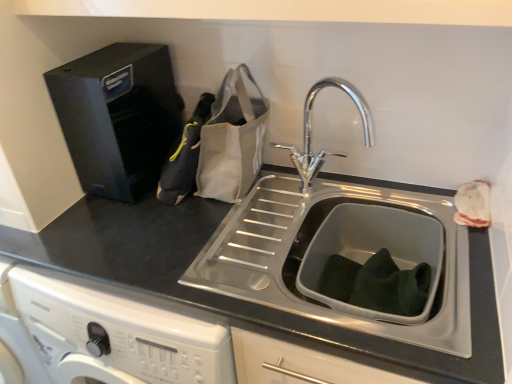
Question: In the image, is black matte countertop at center positioned in front of or behind chrome metallic faucet at center?

Choices:
 (A) front
 (B) behind

Answer: (A)

Question: Would you say black matte countertop at center is inside or outside chrome metallic faucet at center?

Choices:
 (A) inside
 (B) outside

Answer: (B)

Question: Which object is the farthest from the chrome metallic faucet at center?

Choices:
 (A) canvas tote bag at center
 (B) black fabric bag at left
 (C) black plastic water dispenser at upper left
 (D) black matte countertop at center

Answer: (C)

Question: Estimate the real-world distances between objects in this image. Which object is farther from the black plastic water dispenser at upper left?

Choices:
 (A) chrome metallic faucet at center
 (B) black matte countertop at center
 (C) canvas tote bag at center
 (D) black fabric bag at left

Answer: (A)